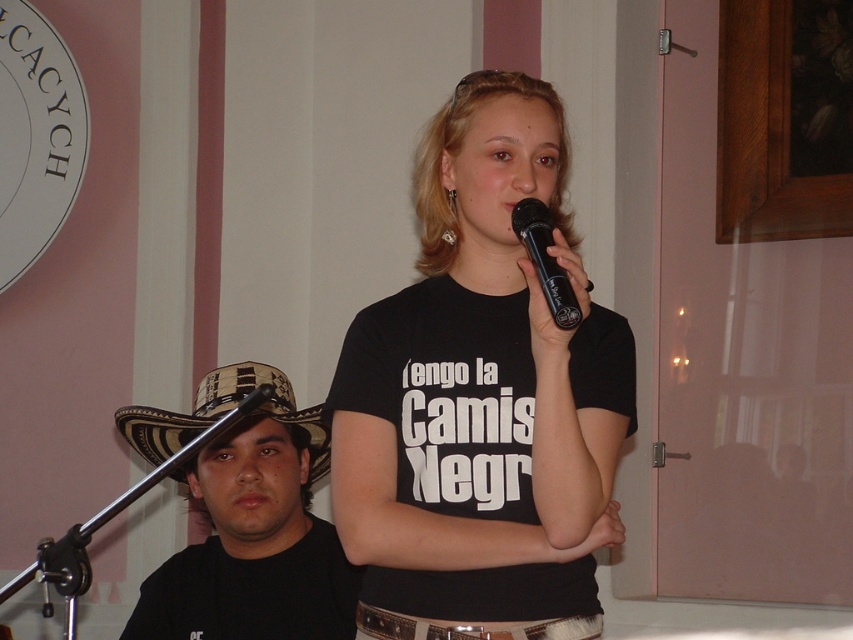
Question: Can you confirm if black matte hat at left is positioned below black plastic microphone at upper center?

Choices:
 (A) yes
 (B) no

Answer: (A)

Question: Which of the following is the closest to the observer?

Choices:
 (A) woven straw cowboy hat at left
 (B) black plastic microphone at upper center
 (C) black matte shirt at center
 (D) black matte hat at left

Answer: (B)

Question: Can you confirm if black matte hat at left is positioned below black plastic microphone at upper center?

Choices:
 (A) yes
 (B) no

Answer: (A)

Question: Can you confirm if black matte hat at left is thinner than black plastic microphone at upper center?

Choices:
 (A) yes
 (B) no

Answer: (B)

Question: Among these objects, which one is nearest to the camera?

Choices:
 (A) woven straw cowboy hat at left
 (B) black matte shirt at center

Answer: (B)

Question: Based on their relative distances, which object is farther from the black matte shirt at center?

Choices:
 (A) black plastic microphone at upper center
 (B) woven straw cowboy hat at left
 (C) black matte hat at left

Answer: (C)